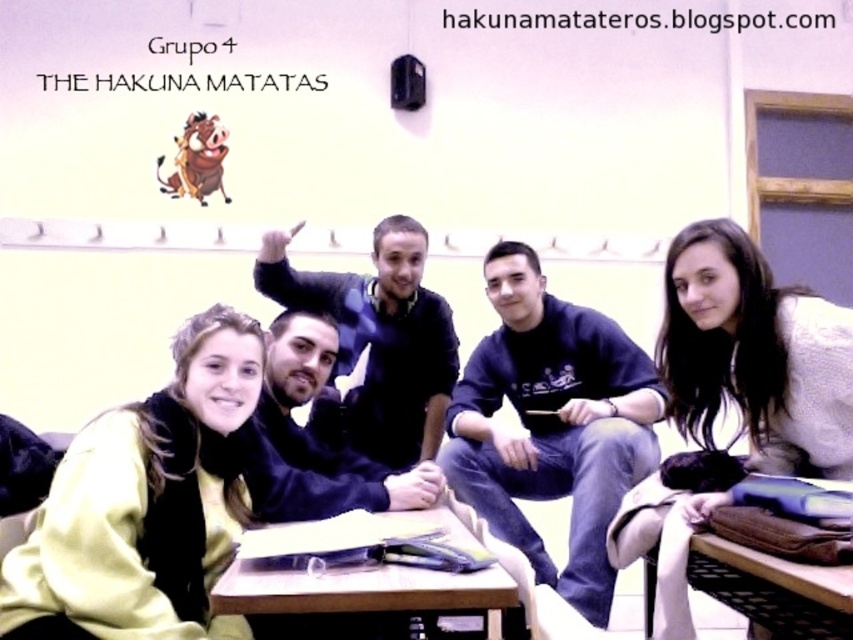
What is located at the coordinates point (x=316, y=435)?

The black matte jacket at center is located at point (x=316, y=435).